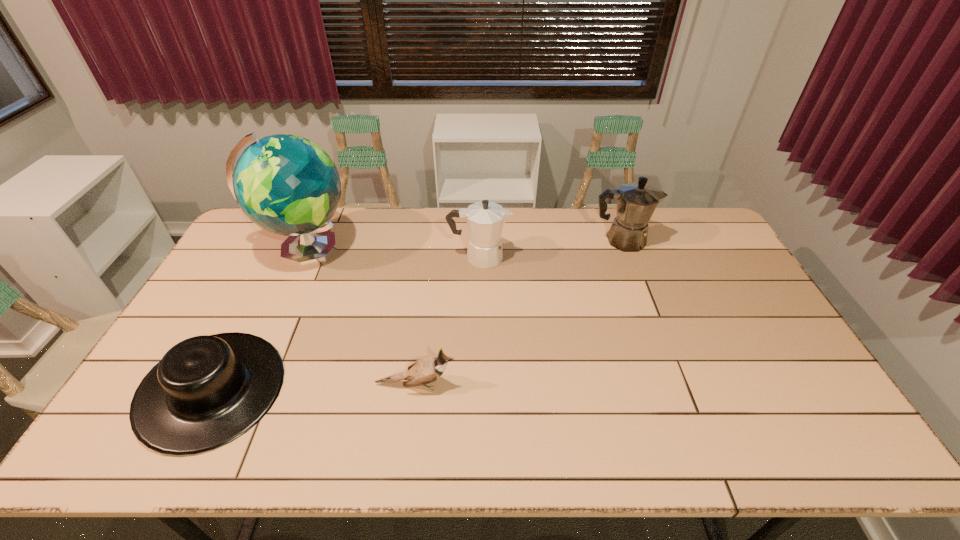
The height and width of the screenshot is (540, 960). Identify the location of vacant area that lies between the bird and the left coffeepot. click(447, 321).

You are a GUI agent. You are given a task and a screenshot of the screen. Output one action in this format:
    pyautogui.click(x=<x>, y=<y>)
    Task: Click on the free space between the right coffeepot and the left coffeepot
    The width and height of the screenshot is (960, 540).
    Given the screenshot: What is the action you would take?
    pyautogui.click(x=550, y=249)

This screenshot has width=960, height=540. Find the location of `free space that is in between the rightmost object and the left coffeepot`. free space that is in between the rightmost object and the left coffeepot is located at coordinates (550, 249).

Identify the location of unoccupied position between the left coffeepot and the right coffeepot. The height and width of the screenshot is (540, 960). (550, 249).

Find the location of a particular element. The width and height of the screenshot is (960, 540). vacant region between the right coffeepot and the globe is located at coordinates (464, 245).

This screenshot has height=540, width=960. Identify the location of free space between the bird and the rightmost object. (518, 312).

Locate an element on the screen. Image resolution: width=960 pixels, height=540 pixels. free spot between the globe and the bird is located at coordinates (361, 317).

At what (x,y) coordinates should I click in order to perform the action: click on empty space between the left coffeepot and the rightmost object. Please return your answer as a coordinate pair (x, y). The height and width of the screenshot is (540, 960). Looking at the image, I should click on (550, 249).

This screenshot has width=960, height=540. In order to click on free space between the tallest object and the rightmost object in this screenshot , I will do `click(464, 245)`.

Identify the location of blank region between the dress hat and the left coffeepot. (346, 323).